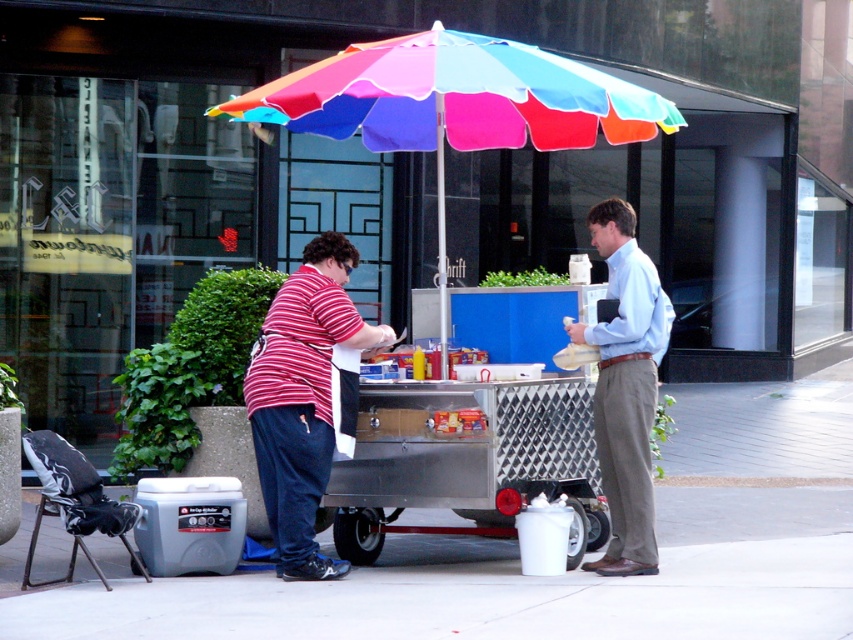
You are standing in front of the street food vendor cart and want to take a photo of the two points mentioned. Which point, point [379,88] or point [253,408], will appear larger in your photo?

Point [379,88] will appear larger in the photo because it is closer to the camera than point [253,408].

You are the customer standing at the light blue shirt at center. To reach the vendor behind the rainbow fabric umbrella at center, should you move to your left or right?

The rainbow fabric umbrella at center is to the left of light blue shirt at center, so you should move to your left to reach the vendor behind the rainbow fabric umbrella at center.

Based on the photo, you are a customer standing in front of the food vendor. You notice the rainbow fabric umbrella at center and the striped cotton shirt at center. Which object is taller?

The striped cotton shirt at center is taller than the rainbow fabric umbrella at center.